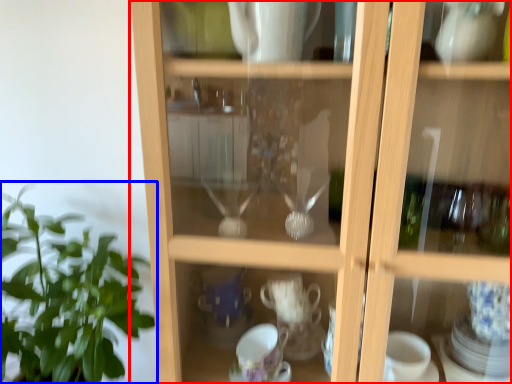
Question: Which point is closer to the camera, cupboard (highlighted by a red box) or houseplant (highlighted by a blue box)?

Choices:
 (A) cupboard
 (B) houseplant

Answer: (A)